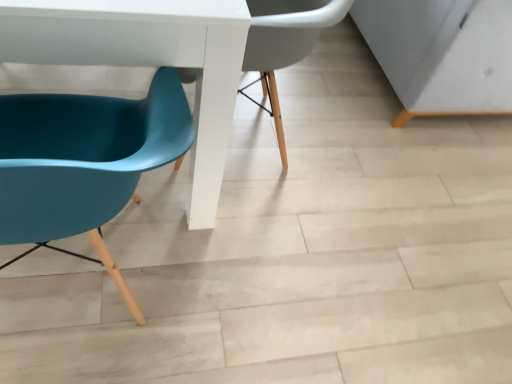
Find the location of `free space to the right of white glossy table at lower left`. free space to the right of white glossy table at lower left is located at coordinates (347, 230).